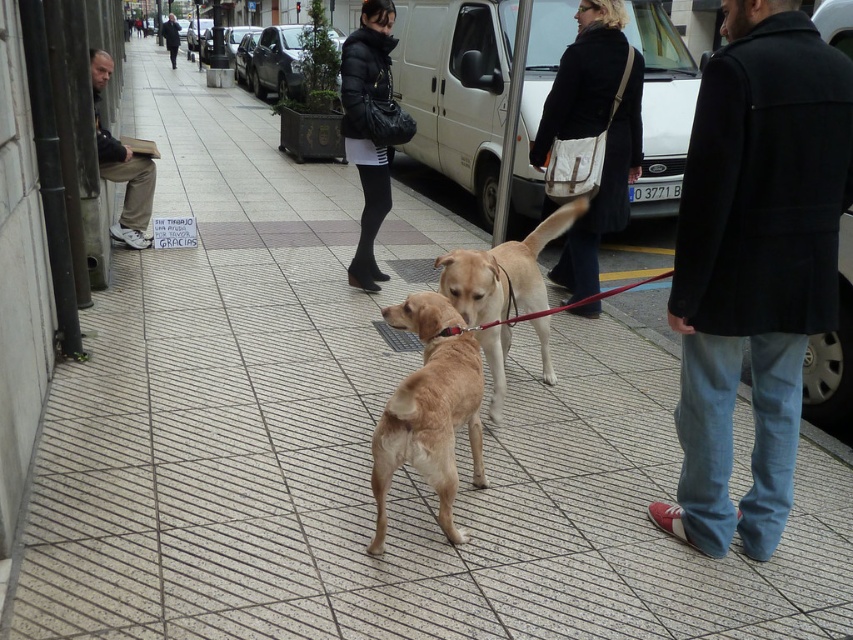
You are a photographer trying to capture a clear photo of the golden fur dog at center and the light brown fur at center. Since you want both dogs to be in focus, which dog should you focus on first to ensure the other is also in focus?

The golden fur dog at center is in front of light brown fur at center. To ensure both are in focus, you should focus on the golden fur dog at center first as it is closer to the camera, allowing the light brown fur at center to be within the depth of field.

You are a photographer trying to capture the light brown fur at center in the frame. Based on its 2D coordinates, where should you position your camera to ensure it is centered in the image?

To center the light brown fur at center in the image, position your camera so that the center of the frame aligns with the coordinates point [502,272].

You are a photographer trying to capture a candid shot of the two jackets mentioned in the scene. Since you want to include both jackets in the frame, which direction should you move your camera to ensure both the matte black jacket at center and the light brown leather jacket at left are visible?

To include both the matte black jacket at center and the light brown leather jacket at left in the frame, you should move your camera to the left. This adjustment will position the camera so that the matte black jacket at center, which is to the right of the light brown leather jacket at left, remains in view while ensuring the light brown leather jacket at left is also captured.